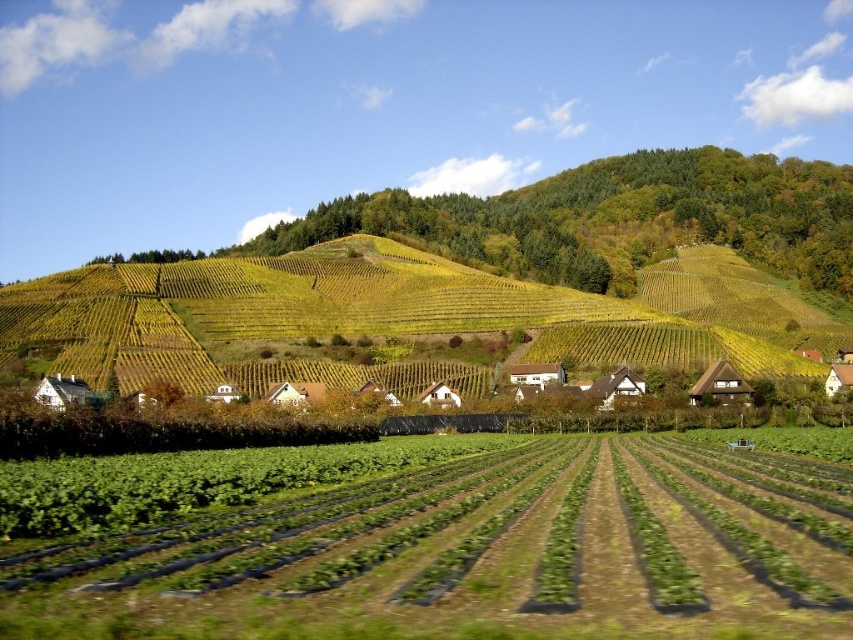
Question: Which point appears closest to the camera in this image?

Choices:
 (A) (103, 372)
 (B) (242, 545)

Answer: (B)

Question: Does green plastic field at center appear on the right side of yellow-green grass at upper center?

Choices:
 (A) no
 (B) yes

Answer: (A)

Question: Does green plastic field at center come in front of yellow-green grass at upper center?

Choices:
 (A) yes
 (B) no

Answer: (A)

Question: Can you confirm if green plastic field at center is thinner than yellow-green grass at upper center?

Choices:
 (A) no
 (B) yes

Answer: (B)

Question: Which point appears farthest from the camera in this image?

Choices:
 (A) (709, 525)
 (B) (700, 253)

Answer: (B)